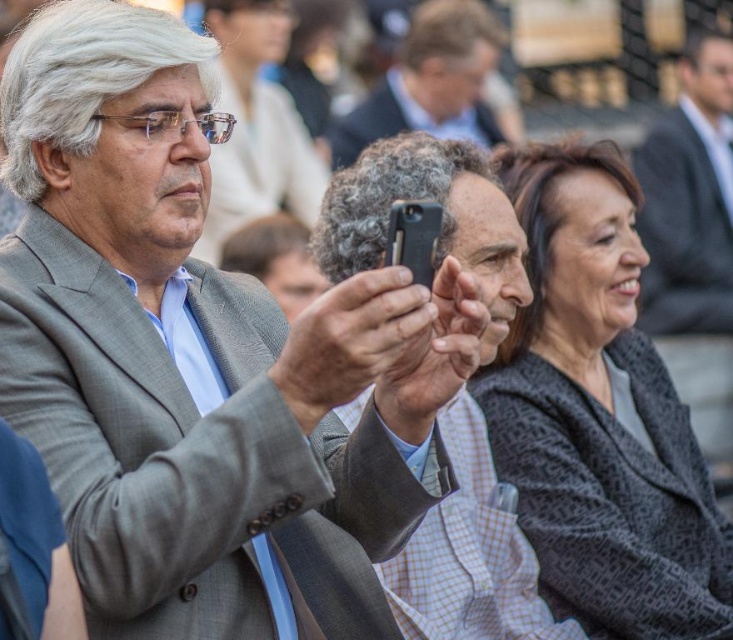
Question: Can you confirm if dark gray textured coat at center is positioned to the right of gray wool suit at center?

Choices:
 (A) yes
 (B) no

Answer: (B)

Question: Which of the following is the farthest from the observer?

Choices:
 (A) (435, 61)
 (B) (430, 630)

Answer: (A)

Question: Can you confirm if matte gray suit at center is positioned to the right of smooth gray hair at center?

Choices:
 (A) yes
 (B) no

Answer: (B)

Question: Is matte gray suit at center to the right of gray wool suit at center from the viewer's perspective?

Choices:
 (A) yes
 (B) no

Answer: (B)

Question: Which point appears farthest from the camera in this image?

Choices:
 (A) (298, 627)
 (B) (453, 106)

Answer: (B)

Question: Which of the following is the closest to the observer?

Choices:
 (A) (445, 602)
 (B) (725, 326)

Answer: (A)